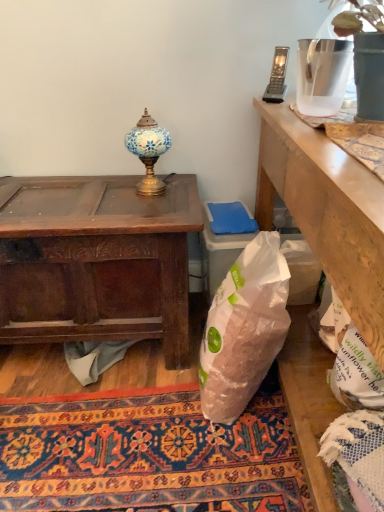
In order to click on vacant space in front of mosaic glass lamp at upper center in this screenshot , I will do `click(155, 201)`.